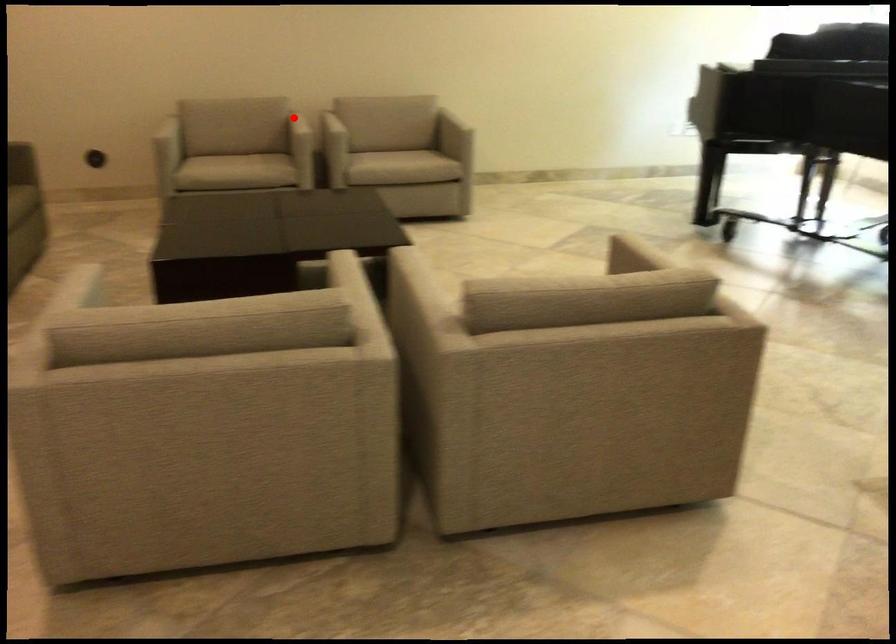
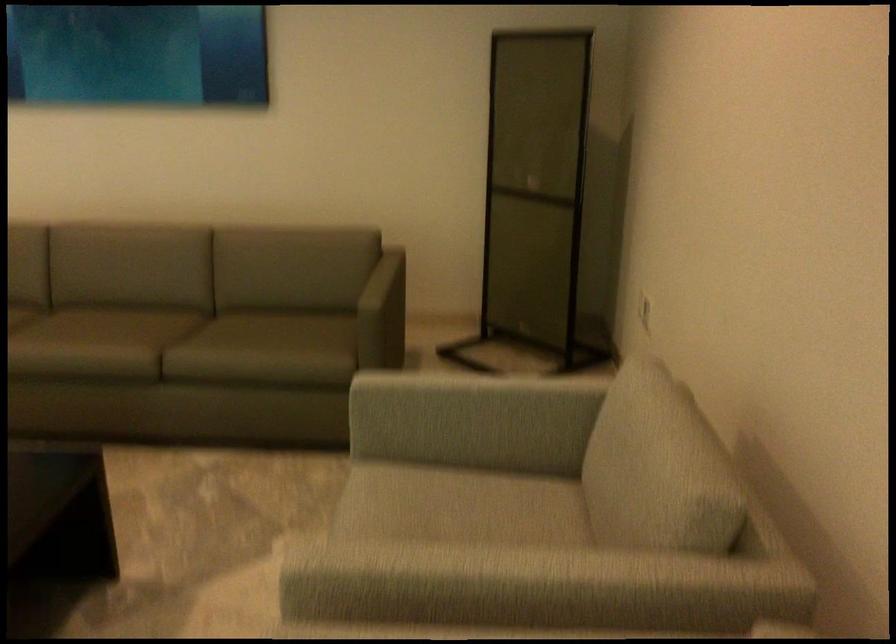
Find the pixel in the second image that matches the highlighted location in the first image.

(479, 573)